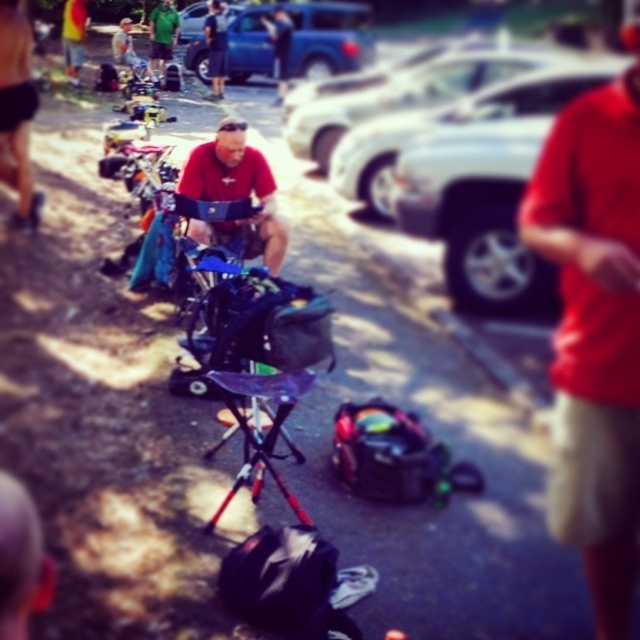
Question: Is red matte shirt at right wider than metallic silver folding chair at center?

Choices:
 (A) no
 (B) yes

Answer: (B)

Question: Based on their relative distances, which object is farther from the matte red shirt at center?

Choices:
 (A) metallic silver folding chair at center
 (B) red matte shirt at right

Answer: (B)

Question: Which object appears closest to the camera in this image?

Choices:
 (A) metallic silver car at right
 (B) blue metallic truck at upper center

Answer: (A)

Question: Considering the relative positions of blue metallic truck at upper center and matte red shirt at center in the image provided, where is blue metallic truck at upper center located with respect to matte red shirt at center?

Choices:
 (A) above
 (B) below

Answer: (A)

Question: Is blue metallic truck at upper center thinner than metallic silver folding chair at center?

Choices:
 (A) no
 (B) yes

Answer: (A)

Question: Which of these objects is positioned farthest from the blue metallic truck at upper center?

Choices:
 (A) metallic silver folding chair at center
 (B) metallic silver car at right

Answer: (A)